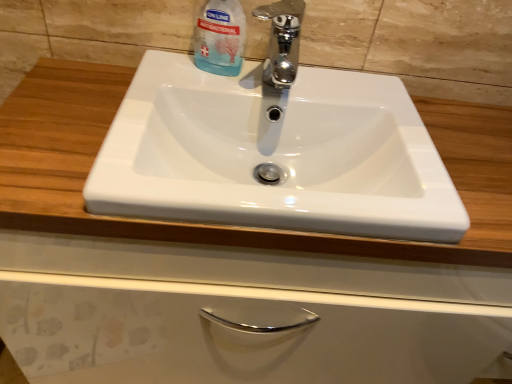
The height and width of the screenshot is (384, 512). Find the location of `vacant region to the right of transparent plastic bottle at upper center`. vacant region to the right of transparent plastic bottle at upper center is located at coordinates (332, 89).